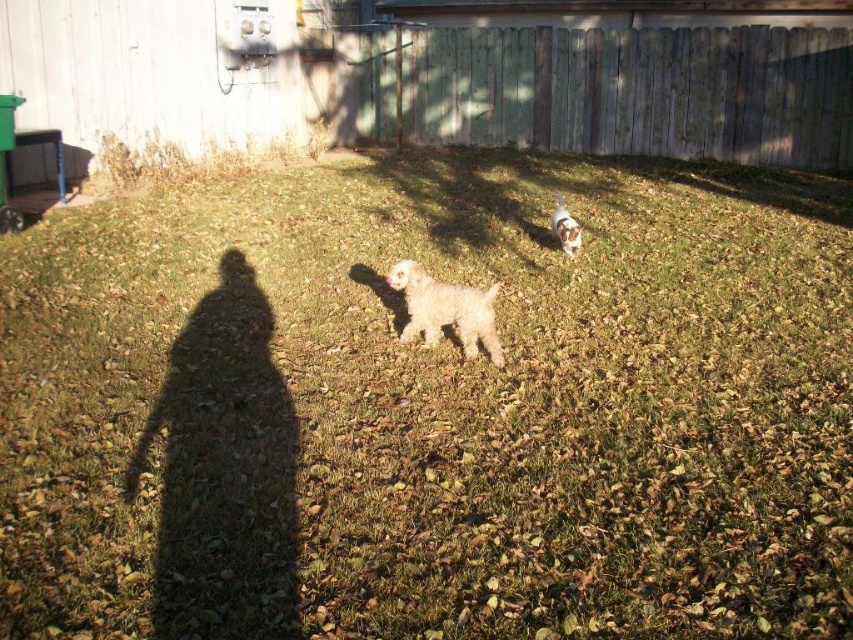
Which is behind, point (453, 285) or point (561, 243)?

Positioned behind is point (561, 243).

Does white fluffy dog at center appear on the right side of white fluffy dog at upper right?

In fact, white fluffy dog at center is to the left of white fluffy dog at upper right.

Find the location of a particular element. The height and width of the screenshot is (640, 853). white fluffy dog at center is located at coordinates coord(445,310).

You are a GUI agent. You are given a task and a screenshot of the screen. Output one action in this format:
    pyautogui.click(x=<x>, y=<y>)
    Task: Click on the white fluffy dog at center
    The height and width of the screenshot is (640, 853).
    Given the screenshot: What is the action you would take?
    pyautogui.click(x=445, y=310)

Is weathered wood fence at upper center bigger than white fluffy dog at center?

Yes, weathered wood fence at upper center is bigger than white fluffy dog at center.

Between weathered wood fence at upper center and white fluffy dog at center, which one has less height?

white fluffy dog at center

Locate an element on the screen. Image resolution: width=853 pixels, height=640 pixels. weathered wood fence at upper center is located at coordinates (604, 90).

From the picture: Is weathered wood fence at upper center wider than white fluffy dog at upper right?

Yes, weathered wood fence at upper center is wider than white fluffy dog at upper right.

Between point (660, 122) and point (561, 202), which one is positioned in front?

Point (561, 202) is in front.

Measure the distance between point (599, 68) and camera.

12.46 meters

Identify the location of weathered wood fence at upper center. The height and width of the screenshot is (640, 853). (604, 90).